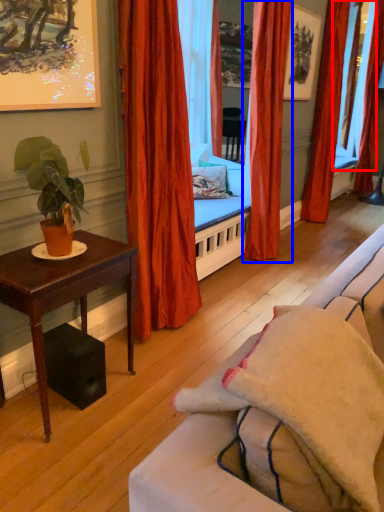
Question: Among these objects, which one is farthest to the camera, window screen (highlighted by a red box) or curtain (highlighted by a blue box)?

Choices:
 (A) window screen
 (B) curtain

Answer: (A)